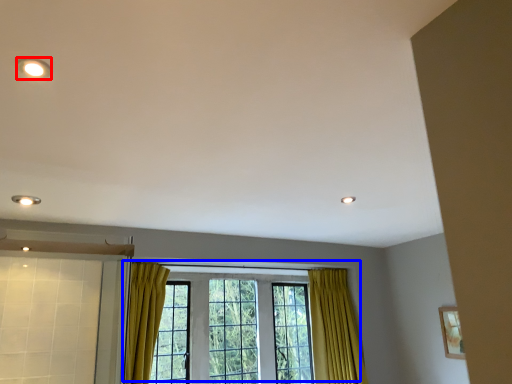
Question: Which object is further to the camera taking this photo, lighting (highlighted by a red box) or window (highlighted by a blue box)?

Choices:
 (A) lighting
 (B) window

Answer: (B)